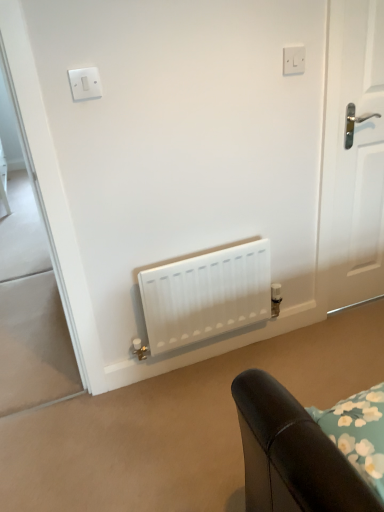
The height and width of the screenshot is (512, 384). Find the location of `white plastic light switch at upper left`. white plastic light switch at upper left is located at coordinates (85, 83).

The width and height of the screenshot is (384, 512). Find the location of `white glossy door at right`. white glossy door at right is located at coordinates (357, 155).

Considering the sizes of objects white matte radiator at center and white plastic light switch at upper left in the image provided, who is taller, white matte radiator at center or white plastic light switch at upper left?

With more height is white matte radiator at center.

Which object is more forward, white matte radiator at center or white plastic light switch at upper left?

white plastic light switch at upper left is more forward.

Is white matte radiator at center completely or partially outside of white plastic light switch at upper left?

Yes, white matte radiator at center is located beyond the bounds of white plastic light switch at upper left.

Is white matte radiator at center touching white glossy door at right?

No.

Can you tell me how much white matte radiator at center and white glossy door at right differ in facing direction?

0.154 degrees.

Which is behind, point (144, 277) or point (373, 256)?

Positioned behind is point (373, 256).

Does white matte radiator at center appear on the left side of white glossy door at right?

Yes, white matte radiator at center is to the left of white glossy door at right.

Which of these two, white plastic switch at upper center or white matte radiator at center, is wider?

white matte radiator at center.

Between white plastic switch at upper center and white matte radiator at center, which one appears on the right side from the viewer's perspective?

From the viewer's perspective, white plastic switch at upper center appears more on the right side.

From the image's perspective, between white plastic switch at upper center and white matte radiator at center, who is located below?

white matte radiator at center appears lower in the image.

Considering the sizes of white plastic switch at upper center and white matte radiator at center in the image, is white plastic switch at upper center bigger or smaller than white matte radiator at center?

Clearly, white plastic switch at upper center is smaller in size than white matte radiator at center.

How different are the orientations of white plastic switch at upper center and white glossy door at right in degrees?

There is a 2.04-degree angle between the facing directions of white plastic switch at upper center and white glossy door at right.

Is white plastic switch at upper center thinner than white glossy door at right?

Indeed, white plastic switch at upper center has a lesser width compared to white glossy door at right.

Does white plastic switch at upper center have a lesser height compared to white glossy door at right?

Yes, white plastic switch at upper center is shorter than white glossy door at right.

From a real-world perspective, is white plastic switch at upper center below white glossy door at right?

Incorrect, from a real-world perspective, white plastic switch at upper center is higher than white glossy door at right.

Is white plastic light switch at upper left far away from white matte radiator at center?

They are positioned close to each other.

Is white matte radiator at center at the back of white plastic light switch at upper left?

white plastic light switch at upper left does not have its back to white matte radiator at center.

Is white matte radiator at center surrounded by white plastic light switch at upper left?

Actually, white matte radiator at center is outside white plastic light switch at upper left.

From the image's perspective, which one is positioned higher, white plastic light switch at upper left or white matte radiator at center?

white plastic light switch at upper left.

Is white glossy door at right thinner than white plastic switch at upper center?

No.

Is white glossy door at right turned away from white plastic switch at upper center?

No, white plastic switch at upper center is not at the back of white glossy door at right.

Which is in front, white glossy door at right or white plastic switch at upper center?

white glossy door at right is more forward.

Is white glossy door at right in contact with white plastic light switch at upper left?

There is a gap between white glossy door at right and white plastic light switch at upper left.

Considering the sizes of objects white glossy door at right and white plastic light switch at upper left in the image provided, who is thinner, white glossy door at right or white plastic light switch at upper left?

white plastic light switch at upper left is thinner.

How many degrees apart are the facing directions of white glossy door at right and white plastic light switch at upper left?

The angle between the facing direction of white glossy door at right and the facing direction of white plastic light switch at upper left is 2.42 degrees.

Does white glossy door at right have a greater height compared to white plastic light switch at upper left?

Yes, white glossy door at right is taller than white plastic light switch at upper left.

The height and width of the screenshot is (512, 384). I want to click on radiator below the white plastic light switch at upper left (from a real-world perspective), so click(x=206, y=295).

Locate an element on the screen. door to the right of white matte radiator at center is located at coordinates (357, 155).

Looking at the image, which one is located further to white plastic light switch at upper left, white plastic switch at upper center or white matte radiator at center?

white matte radiator at center lies further to white plastic light switch at upper left than the other object.

Considering their positions, is white glossy door at right positioned further to white plastic light switch at upper left than white plastic switch at upper center?

The object further to white plastic light switch at upper left is white glossy door at right.

Looking at the image, which one is located further to white matte radiator at center, white plastic light switch at upper left or white plastic switch at upper center?

Among the two, white plastic switch at upper center is located further to white matte radiator at center.

Based on their spatial positions, is white plastic switch at upper center or white plastic light switch at upper left further from white glossy door at right?

The object further to white glossy door at right is white plastic light switch at upper left.

Considering their positions, is white matte radiator at center positioned closer to white glossy door at right than white plastic light switch at upper left?

Among the two, white matte radiator at center is located nearer to white glossy door at right.

From the image, which object appears to be farther from white plastic light switch at upper left, white glossy door at right or white matte radiator at center?

Based on the image, white glossy door at right appears to be further to white plastic light switch at upper left.

From the picture: Looking at the image, which one is located closer to white plastic switch at upper center, white matte radiator at center or white glossy door at right?

The object closer to white plastic switch at upper center is white glossy door at right.

Looking at the image, which one is located closer to white plastic switch at upper center, white glossy door at right or white plastic light switch at upper left?

Based on the image, white glossy door at right appears to be nearer to white plastic switch at upper center.

Locate an element on the screen. The height and width of the screenshot is (512, 384). electric outlet between white plastic light switch at upper left and white glossy door at right in the horizontal direction is located at coordinates (293, 60).

This screenshot has width=384, height=512. Find the location of `light switch between white plastic switch at upper center and white matte radiator at center in the up-down direction`. light switch between white plastic switch at upper center and white matte radiator at center in the up-down direction is located at coordinates (85, 83).

The height and width of the screenshot is (512, 384). What are the coordinates of `door between white plastic switch at upper center and white matte radiator at center vertically` in the screenshot? It's located at (357, 155).

Where is `radiator situated between white plastic light switch at upper left and white glossy door at right from left to right`? The height and width of the screenshot is (512, 384). radiator situated between white plastic light switch at upper left and white glossy door at right from left to right is located at coordinates (206, 295).